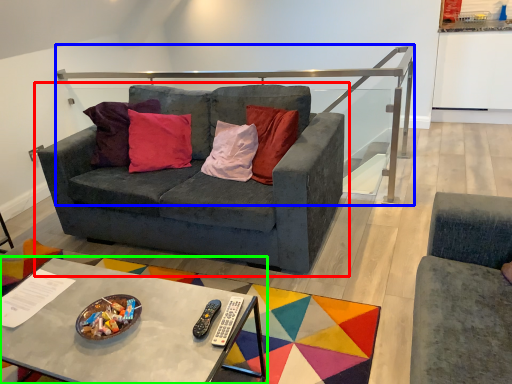
Question: Based on their relative distances, which object is nearer to studio couch (highlighted by a red box)? Choose from balustrade (highlighted by a blue box) and coffee table (highlighted by a green box).

Choices:
 (A) balustrade
 (B) coffee table

Answer: (B)